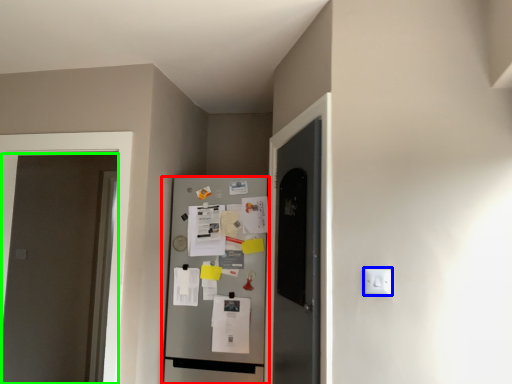
Question: Estimate the real-world distances between objects in this image. Which object is closer to refrigerator (highlighted by a red box), electric outlet (highlighted by a blue box) or door (highlighted by a green box)?

Choices:
 (A) electric outlet
 (B) door

Answer: (A)